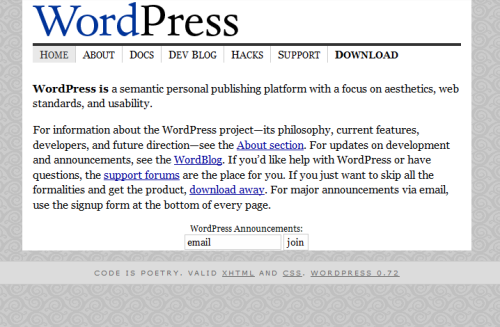
The image size is (500, 327). Identify the location of divider. pos(227,43).